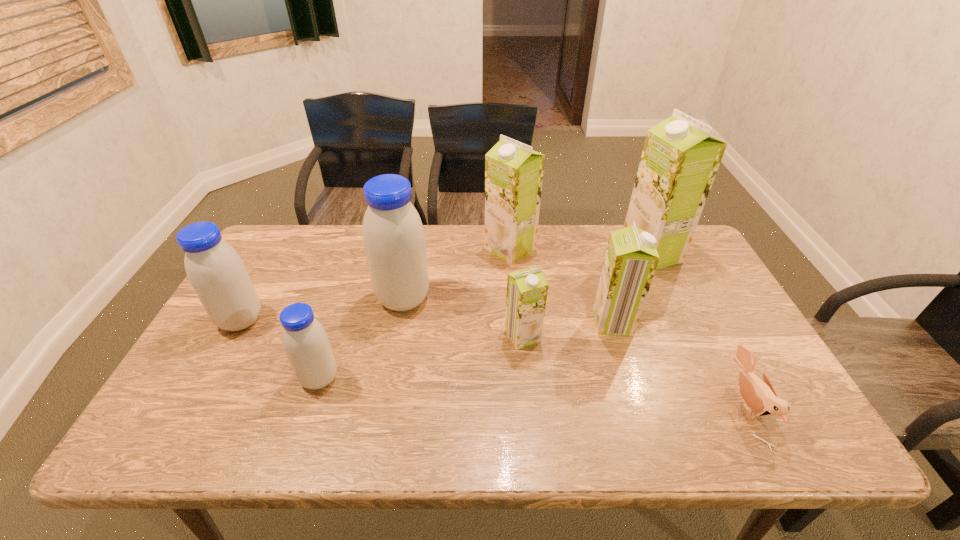
Where is `soya milk that is the fifth closest one to the shortest object`? This screenshot has height=540, width=960. soya milk that is the fifth closest one to the shortest object is located at coordinates (393, 235).

Identify which soya milk is the third closest to the rightmost soya milk. Please provide its 2D coordinates. Your answer should be formatted as a tuple, i.e. [(x, y)], where the tuple contains the x and y coordinates of a point satisfying the conditions above.

[(527, 289)]

Image resolution: width=960 pixels, height=540 pixels. Identify the location of green soya milk that is the closest to the second object from left to right. (527, 289).

Identify which green soya milk is the third closest to the rightmost green soya milk. Please provide its 2D coordinates. Your answer should be formatted as a tuple, i.e. [(x, y)], where the tuple contains the x and y coordinates of a point satisfying the conditions above.

[(527, 289)]

Locate which blue soya milk is the third closest to the biggest green soya milk. Please provide its 2D coordinates. Your answer should be formatted as a tuple, i.e. [(x, y)], where the tuple contains the x and y coordinates of a point satisfying the conditions above.

[(215, 270)]

Locate an element on the screen. The width and height of the screenshot is (960, 540). blue soya milk that is the second closest one to the smallest green soya milk is located at coordinates (305, 341).

Image resolution: width=960 pixels, height=540 pixels. I want to click on free spot that satisfies the following two spatial constraints: 1. on the back side of the fifth soya milk from right to left; 2. on the right side of the nearest blue soya milk, so tap(346, 299).

Where is `free location that satisfies the following two spatial constraints: 1. on the front side of the third green soya milk from left to right; 2. on the right side of the second biggest green soya milk`? This screenshot has height=540, width=960. free location that satisfies the following two spatial constraints: 1. on the front side of the third green soya milk from left to right; 2. on the right side of the second biggest green soya milk is located at coordinates (516, 322).

This screenshot has width=960, height=540. What are the coordinates of `vacant space that satisfies the following two spatial constraints: 1. on the front side of the second smallest green soya milk; 2. on the left side of the second biggest green soya milk` in the screenshot? It's located at (516, 322).